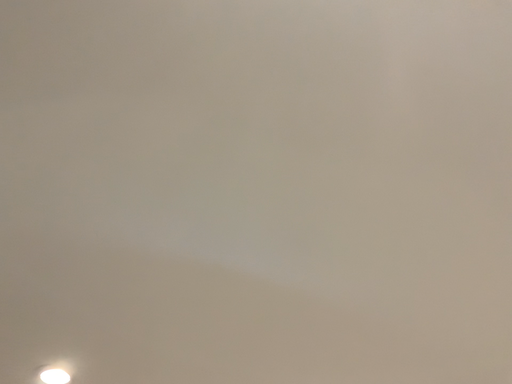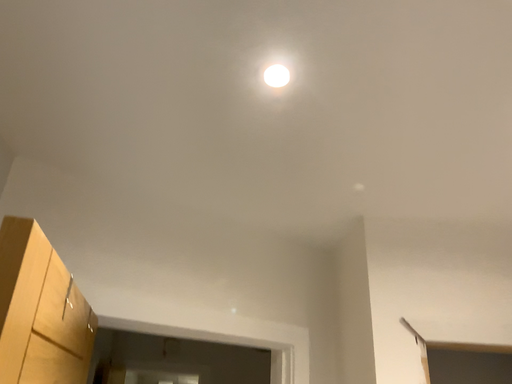
Question: How did the camera likely rotate when shooting the video?

Choices:
 (A) rotated upward
 (B) rotated downward

Answer: (B)